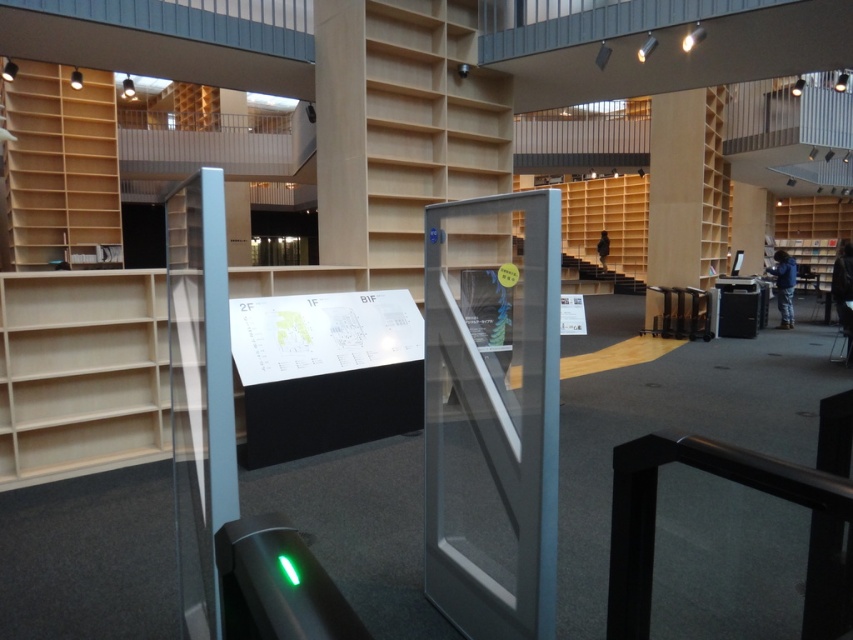
Question: Can you confirm if transparent glass door at center is wider than light wood bookshelf at center?

Choices:
 (A) yes
 (B) no

Answer: (B)

Question: Is light wood bookshelf at center bigger than wooden bookshelf at right?

Choices:
 (A) yes
 (B) no

Answer: (B)

Question: Is the position of light wood bookshelf at center more distant than that of wooden shelves at upper left?

Choices:
 (A) yes
 (B) no

Answer: (B)

Question: Which point is closer to the camera?

Choices:
 (A) (90, 291)
 (B) (67, 161)
 (C) (494, 291)
 (D) (596, 216)

Answer: (C)

Question: Among these objects, which one is nearest to the camera?

Choices:
 (A) wooden bookshelf at right
 (B) transparent glass door at center
 (C) light wood bookshelf at center

Answer: (B)

Question: Which of the following is the farthest from the observer?

Choices:
 (A) (625, 198)
 (B) (799, 246)

Answer: (B)